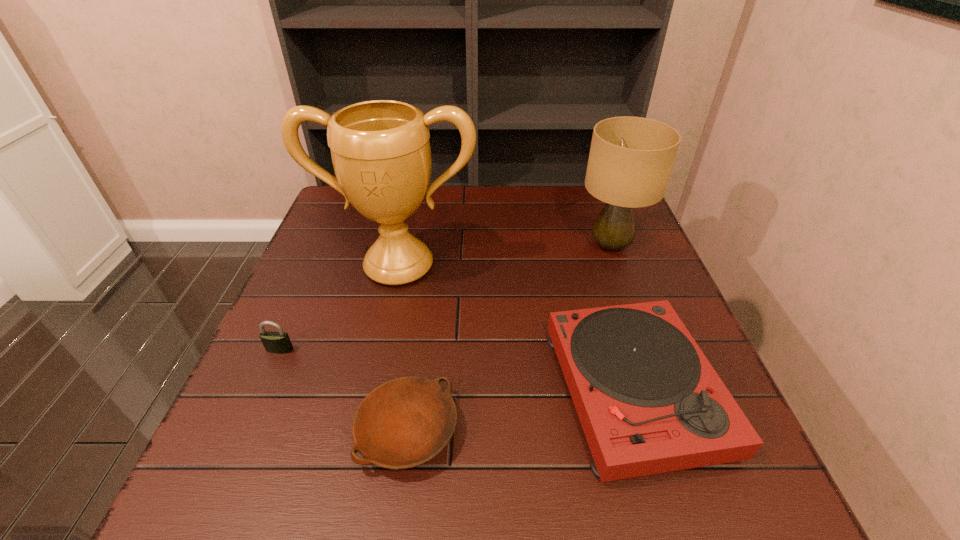
Find the location of a particular element. The image size is (960, 540). object positioned at the far edge is located at coordinates (631, 158).

Where is `record player that is at the near edge`? record player that is at the near edge is located at coordinates (649, 401).

You are a GUI agent. You are given a task and a screenshot of the screen. Output one action in this format:
    pyautogui.click(x=<x>, y=<y>)
    Task: Click on the plate located in the near edge section of the desktop
    Image resolution: width=960 pixels, height=540 pixels.
    Given the screenshot: What is the action you would take?
    pyautogui.click(x=404, y=422)

At what (x,y) coordinates should I click in order to perform the action: click on award present at the left edge. Please return your answer as a coordinate pair (x, y). The height and width of the screenshot is (540, 960). Looking at the image, I should click on (381, 155).

Where is `padlock situated at the left edge`? This screenshot has width=960, height=540. padlock situated at the left edge is located at coordinates (279, 342).

Find the location of `lampshade located in the right edge section of the desktop`. lampshade located in the right edge section of the desktop is located at coordinates (631, 158).

What are the coordinates of `record player that is at the right edge` in the screenshot? It's located at (649, 401).

In order to click on object situated at the far right corner in this screenshot , I will do `click(631, 158)`.

Locate an element on the screen. The height and width of the screenshot is (540, 960). object at the near right corner is located at coordinates (x=649, y=401).

Locate an element on the screen. This screenshot has width=960, height=540. vacant space at the far edge of the desktop is located at coordinates (499, 202).